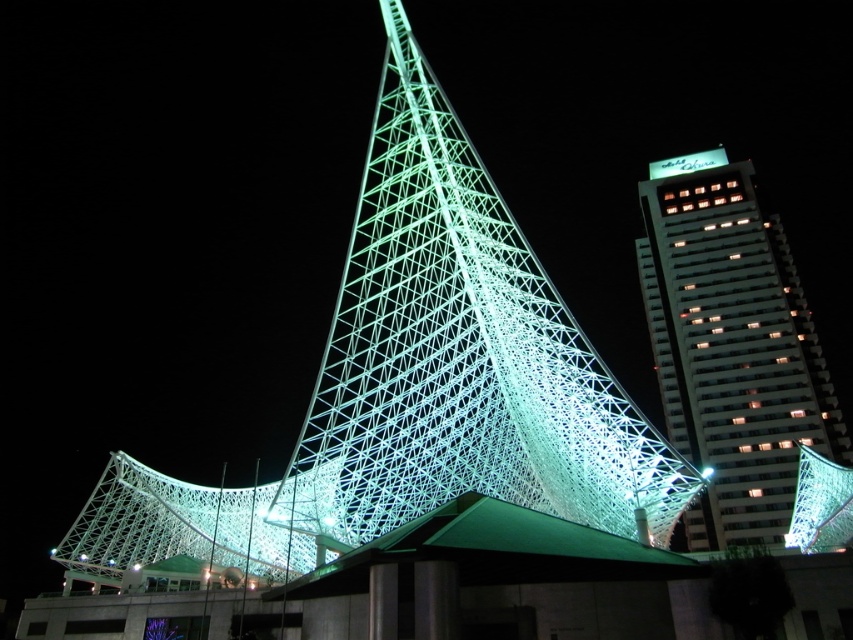
You are an architect analyzing the lighting design of the scene. You notice the illuminated mesh structure at center and the green illuminated sign at upper right. Which object would require more power to illuminate, considering their sizes and the scene description?

The illuminated mesh structure at center requires more power to illuminate because it is larger in size than the green illuminated sign at upper right, as stated in the scene description.

You are an architect evaluating the placement of a new sculpture. You see the illuminated mesh structure at center and the white glass skyscraper at upper right. Which object is positioned lower in the scene?

The illuminated mesh structure at center is positioned lower than the white glass skyscraper at upper right.

You are standing at the base of the tall building in the background and want to take a photo of the point at coordinates point (817,392). Given that your camera has a maximum focus range of 150 meters, will you be able to focus on the point?

The distance of point (817,392) is 155.68 meters from the camera, which exceeds the maximum focus range of 150 meters. Therefore, you will not be able to focus on the point.